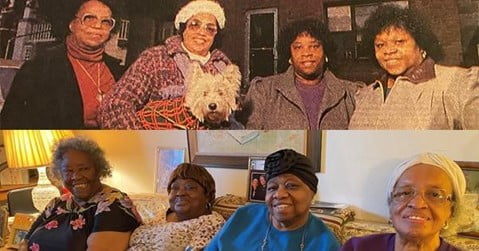
Where is `lamp shade`? lamp shade is located at coordinates (29, 138).